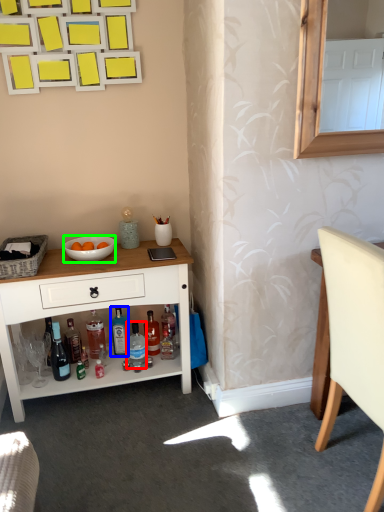
Question: Which object is positioned closest to bottle (highlighted by a red box)? Select from bottle (highlighted by a blue box) and bowl (highlighted by a green box).

Choices:
 (A) bottle
 (B) bowl

Answer: (A)